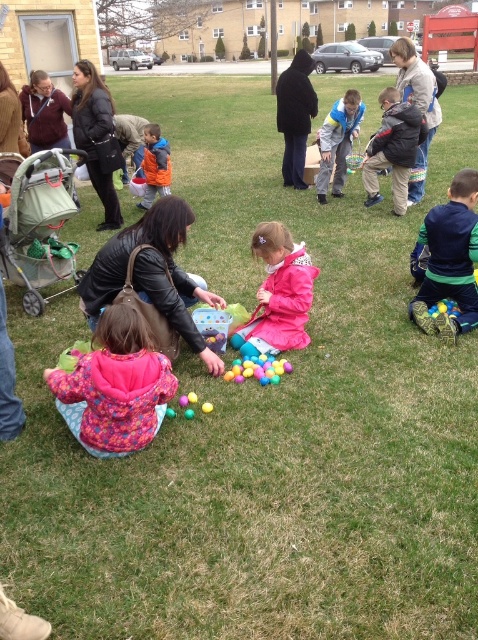
Question: Can you confirm if pink matte jacket at center is smaller than rubber yellow ball at center?

Choices:
 (A) no
 (B) yes

Answer: (A)

Question: Which object is closer to the camera taking this photo?

Choices:
 (A) pink matte jacket at center
 (B) rubberized plastic eggs at center

Answer: (B)

Question: Does matte green stroller at left appear under blue denim jacket at center?

Choices:
 (A) no
 (B) yes

Answer: (B)

Question: Considering the relative positions of blue denim jacket at center and rubberized plastic eggs at center in the image provided, where is blue denim jacket at center located with respect to rubberized plastic eggs at center?

Choices:
 (A) left
 (B) right

Answer: (B)

Question: Estimate the real-world distances between objects in this image. Which object is closer to the dark gray jacket at center?

Choices:
 (A) rubber yellow ball at center
 (B) fluffy pink jacket at lower left
 (C) orange fleece jacket at center
 (D) pink matte jacket at center

Answer: (C)

Question: Which point appears farthest from the camera in this image?

Choices:
 (A) (162, 192)
 (B) (434, 208)
 (C) (170, 221)

Answer: (A)